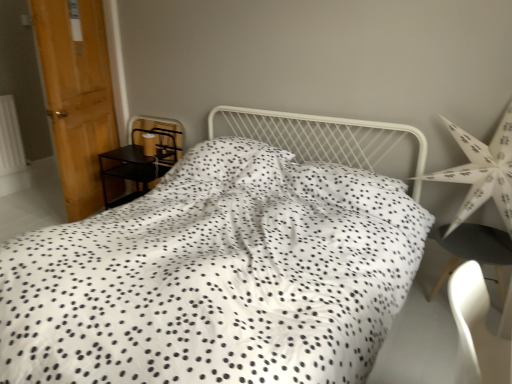
At what (x,y) coordinates should I click in order to perform the action: click on white dotted fabric bed at center. Please return your answer as a coordinate pair (x, y). The height and width of the screenshot is (384, 512). Looking at the image, I should click on (216, 277).

This screenshot has height=384, width=512. Identify the location of white paper star at right. (482, 171).

The height and width of the screenshot is (384, 512). In order to click on white dotted fabric bed at center in this screenshot , I will do `click(216, 277)`.

From a real-world perspective, is matte brown lampshade at left over white dotted fabric bed at center?

Yes, from a real-world perspective, matte brown lampshade at left is on top of white dotted fabric bed at center.

Based on the photo, who is shorter, matte brown lampshade at left or white dotted fabric bed at center?

With less height is matte brown lampshade at left.

How distant is matte brown lampshade at left from white dotted fabric bed at center?

matte brown lampshade at left and white dotted fabric bed at center are 2.00 meters apart.

Is matte brown lampshade at left looking in the opposite direction of white dotted fabric bed at center?

No, matte brown lampshade at left's orientation is not away from white dotted fabric bed at center.

Can you confirm if matte brown lampshade at left is positioned to the right of black matte chair at lower right?

No, matte brown lampshade at left is not to the right of black matte chair at lower right.

From a real-world perspective, relative to black matte chair at lower right, is matte brown lampshade at left vertically above or below?

In terms of real-world spatial position, matte brown lampshade at left is above black matte chair at lower right.

How distant is matte brown lampshade at left from black matte chair at lower right?

matte brown lampshade at left is 8.31 feet away from black matte chair at lower right.

Can you confirm if matte brown lampshade at left is wider than black matte chair at lower right?

In fact, matte brown lampshade at left might be narrower than black matte chair at lower right.

Considering the relative sizes of black matte chair at lower right and black metal nightstand at left in the image provided, is black matte chair at lower right wider than black metal nightstand at left?

Correct, the width of black matte chair at lower right exceeds that of black metal nightstand at left.

Is black metal nightstand at left completely or partially inside black matte chair at lower right?

No, black metal nightstand at left is not inside black matte chair at lower right.

Is black matte chair at lower right at the left side of black metal nightstand at left?

No, black matte chair at lower right is not to the left of black metal nightstand at left.

Which is behind, black matte chair at lower right or white paper star at right?

black matte chair at lower right is more distant.

Considering the points (461, 230) and (476, 146), which point is behind, point (461, 230) or point (476, 146)?

The point (461, 230) is farther.

Is black matte chair at lower right to the left or to the right of white paper star at right in the image?

From the image, it's evident that black matte chair at lower right is to the right of white paper star at right.

Which is correct: black matte chair at lower right is inside white paper star at right, or outside of it?

black matte chair at lower right exists outside the volume of white paper star at right.

Considering the positions of objects black metal nightstand at left and white paper star at right in the image provided, who is more to the left, black metal nightstand at left or white paper star at right?

black metal nightstand at left is more to the left.

Consider the image. From a real-world perspective, who is located higher, black metal nightstand at left or white paper star at right?

white paper star at right is physically above.

From the image's perspective, would you say black metal nightstand at left is positioned over white paper star at right?

No, from the image's perspective, black metal nightstand at left is not on top of white paper star at right.

Would you say black metal nightstand at left is inside or outside white paper star at right?

black metal nightstand at left exists outside the volume of white paper star at right.

Can white dotted fabric bed at center be found inside black matte chair at lower right?

No, white dotted fabric bed at center is not a part of black matte chair at lower right.

Does point (469, 229) appear closer or farther from the camera than point (314, 312)?

Point (469, 229).

This screenshot has width=512, height=384. In order to click on table on the right of white dotted fabric bed at center in this screenshot , I will do `click(475, 251)`.

Is black matte chair at lower right at the right side of white dotted fabric bed at center?

Correct, you'll find black matte chair at lower right to the right of white dotted fabric bed at center.

Which is in front, point (75, 171) or point (503, 139)?

The point (503, 139) is more forward.

Does wooden door at left appear on the right side of white paper star at right?

Incorrect, wooden door at left is not on the right side of white paper star at right.

Considering the relative sizes of wooden door at left and white paper star at right in the image provided, is wooden door at left smaller than white paper star at right?

Yes.

From the image's perspective, does wooden door at left appear higher than white paper star at right?

Correct, wooden door at left appears higher than white paper star at right in the image.

The width and height of the screenshot is (512, 384). I want to click on table lamp above the white dotted fabric bed at center (from the image's perspective), so click(149, 144).

Where is `table lamp above the black matte chair at lower right (from a real-world perspective)`? table lamp above the black matte chair at lower right (from a real-world perspective) is located at coordinates (149, 144).

Estimate the real-world distances between objects in this image. Which object is closer to black matte chair at lower right, wooden door at left or white dotted fabric bed at center?

The object closer to black matte chair at lower right is white dotted fabric bed at center.

When comparing their distances from black matte chair at lower right, does white dotted fabric bed at center or black metal nightstand at left seem closer?

Based on the image, white dotted fabric bed at center appears to be nearer to black matte chair at lower right.

Looking at the image, which one is located further to white dotted fabric bed at center, black matte chair at lower right or matte brown lampshade at left?

matte brown lampshade at left is further to white dotted fabric bed at center.

When comparing their distances from wooden door at left, does black metal nightstand at left or white paper star at right seem closer?

Based on the image, black metal nightstand at left appears to be nearer to wooden door at left.

Considering their positions, is matte brown lampshade at left positioned further to white dotted fabric bed at center than white paper star at right?

matte brown lampshade at left is further to white dotted fabric bed at center.

Considering their positions, is matte brown lampshade at left positioned closer to black matte chair at lower right than wooden door at left?

The object closer to black matte chair at lower right is matte brown lampshade at left.

When comparing their distances from white paper star at right, does matte brown lampshade at left or black metal nightstand at left seem further?

matte brown lampshade at left is further to white paper star at right.

In the scene shown: Considering their positions, is black metal nightstand at left positioned further to black matte chair at lower right than white dotted fabric bed at center?

Among the two, black metal nightstand at left is located further to black matte chair at lower right.

Image resolution: width=512 pixels, height=384 pixels. I want to click on furniture located between wooden door at left and black matte chair at lower right in the left-right direction, so click(x=143, y=156).

Find the location of a particular element. The image size is (512, 384). star positioned between white dotted fabric bed at center and black metal nightstand at left from near to far is located at coordinates (482, 171).

At what (x,y) coordinates should I click in order to perform the action: click on table lamp between wooden door at left and black matte chair at lower right from left to right. Please return your answer as a coordinate pair (x, y). The image size is (512, 384). Looking at the image, I should click on (149, 144).

Where is `table lamp between black metal nightstand at left and black matte chair at lower right in the horizontal direction`? This screenshot has height=384, width=512. table lamp between black metal nightstand at left and black matte chair at lower right in the horizontal direction is located at coordinates (149, 144).